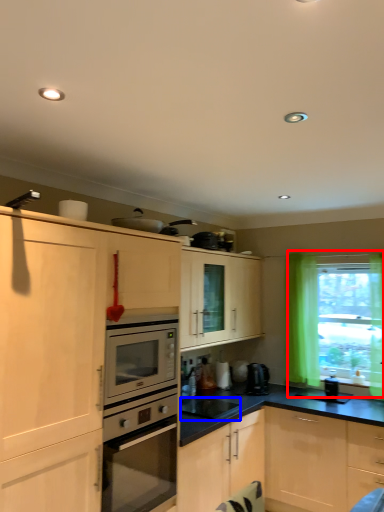
Question: Among these objects, which one is farthest to the camera, window (highlighted by a red box) or appliance (highlighted by a blue box)?

Choices:
 (A) window
 (B) appliance

Answer: (A)